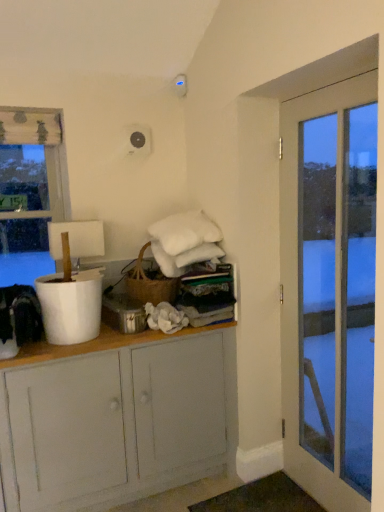
This screenshot has height=512, width=384. What do you see at coordinates (117, 419) in the screenshot?
I see `white painted wood cabinet at center` at bounding box center [117, 419].

This screenshot has width=384, height=512. What are the coordinates of `transparent glass window at left` in the screenshot? It's located at (29, 191).

Where is `white painted wood cabinet at center`? Image resolution: width=384 pixels, height=512 pixels. white painted wood cabinet at center is located at coordinates coord(117,419).

Can you confirm if white glass door at right is positioned to the right of white painted wood cabinet at center?

Yes, white glass door at right is to the right of white painted wood cabinet at center.

Image resolution: width=384 pixels, height=512 pixels. I want to click on door above the white painted wood cabinet at center (from the image's perspective), so click(x=329, y=289).

Which of these two, white glass door at right or white painted wood cabinet at center, is thinner?

white glass door at right is thinner.

Is transparent glass window at left next to white glass door at right and touching it?

No, transparent glass window at left is not making contact with white glass door at right.

Is point (3, 259) behind point (364, 358)?

That is False.

Measure the distance between transparent glass window at left and white glass door at right.

transparent glass window at left and white glass door at right are 5.68 feet apart.

Consider the image. From a real-world perspective, is transparent glass window at left above or below white glass door at right?

Clearly, from a real-world perspective, transparent glass window at left is above white glass door at right.

Is transparent glass window at left completely or partially outside of white painted wood cabinet at center?

Indeed, transparent glass window at left is completely outside white painted wood cabinet at center.

Identify the location of window that appears behind the white painted wood cabinet at center. (29, 191).

Can you tell me how much transparent glass window at left and white painted wood cabinet at center differ in facing direction?

0.309 degrees separate the facing orientations of transparent glass window at left and white painted wood cabinet at center.

Which is in front, transparent glass window at left or white painted wood cabinet at center?

white painted wood cabinet at center is closer to the camera.

Which of these two, white glass door at right or transparent glass window at left, stands taller?

Standing taller between the two is white glass door at right.

Is white glass door at right positioned with its back to transparent glass window at left?

No.

Would you say transparent glass window at left is part of white glass door at right's contents?

That's incorrect, transparent glass window at left is not inside white glass door at right.

How different are the orientations of white glass door at right and transparent glass window at left in degrees?

The angular difference between white glass door at right and transparent glass window at left is 88.4 degrees.

Is white painted wood cabinet at center positioned beyond the bounds of transparent glass window at left?

white painted wood cabinet at center lies outside transparent glass window at left's area.

Image resolution: width=384 pixels, height=512 pixels. I want to click on cabinetry in front of the transparent glass window at left, so click(x=117, y=419).

From the image's perspective, relative to transparent glass window at left, is white painted wood cabinet at center above or below?

white painted wood cabinet at center is below transparent glass window at left.

How different are the orientations of white painted wood cabinet at center and white glass door at right in degrees?

88.7 degrees.

Considering the points (3, 411) and (315, 170), which point is behind, point (3, 411) or point (315, 170)?

The point (315, 170) is farther.

From the image's perspective, who appears lower, white painted wood cabinet at center or white glass door at right?

white painted wood cabinet at center is shown below in the image.

Is white painted wood cabinet at center not inside white glass door at right?

white painted wood cabinet at center lies outside white glass door at right's area.

This screenshot has width=384, height=512. There is a white painted wood cabinet at center. What are the coordinates of `door above it (from a real-world perspective)` in the screenshot? It's located at (329, 289).

At what (x,y) coordinates should I click in order to perform the action: click on window above the white glass door at right (from the image's perspective). Please return your answer as a coordinate pair (x, y). The image size is (384, 512). Looking at the image, I should click on (29, 191).

Based on the photo, which object lies nearer to the anchor point white glass door at right, white painted wood cabinet at center or transparent glass window at left?

The object closer to white glass door at right is white painted wood cabinet at center.

Which object lies nearer to the anchor point white painted wood cabinet at center, transparent glass window at left or white glass door at right?

white glass door at right is positioned closer to the anchor white painted wood cabinet at center.

Based on their spatial positions, is transparent glass window at left or white painted wood cabinet at center closer to white glass door at right?

white painted wood cabinet at center.

Considering their positions, is white glass door at right positioned closer to transparent glass window at left than white painted wood cabinet at center?

Based on the image, white painted wood cabinet at center appears to be nearer to transparent glass window at left.

From the image, which object appears to be farther from white painted wood cabinet at center, white glass door at right or transparent glass window at left?

transparent glass window at left lies further to white painted wood cabinet at center than the other object.

From the image, which object appears to be farther from transparent glass window at left, white painted wood cabinet at center or white glass door at right?

white glass door at right is positioned further to the anchor transparent glass window at left.

I want to click on cabinetry between transparent glass window at left and white glass door at right, so click(117, 419).